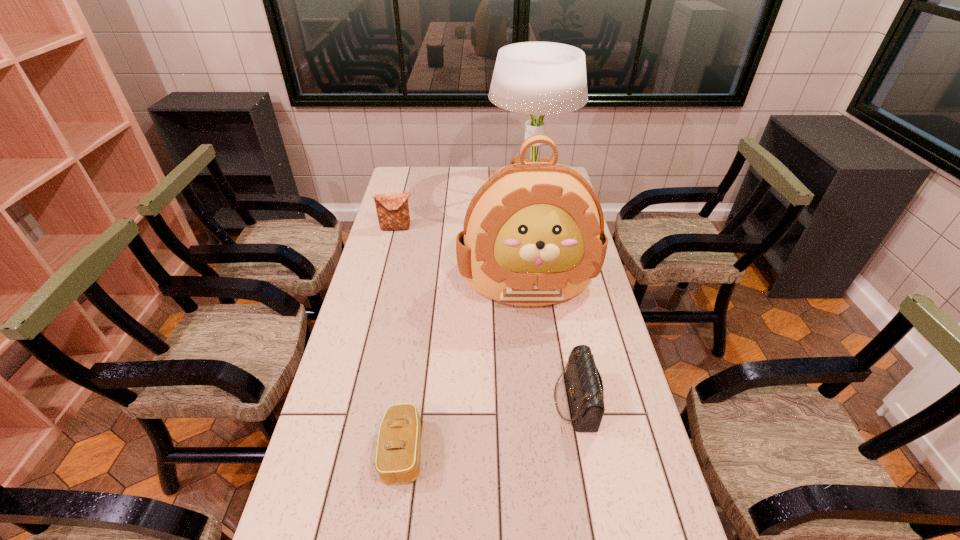
You are a GUI agent. You are given a task and a screenshot of the screen. Output one action in this format:
    pyautogui.click(x=<x>, y=<y>)
    Task: Click on the free location located 0.250m on the front-facing side of the farthest object
    Image resolution: width=960 pixels, height=540 pixels.
    Given the screenshot: What is the action you would take?
    pyautogui.click(x=431, y=193)

This screenshot has height=540, width=960. In order to click on free region located 0.210m on the front-facing side of the backpack in this screenshot , I will do `click(539, 378)`.

Identify the location of vacant region located on the open side of the leftmost clutch bag. (377, 305).

This screenshot has height=540, width=960. Find the location of `free location located 0.400m on the front flap of the second tallest clutch bag`. free location located 0.400m on the front flap of the second tallest clutch bag is located at coordinates (403, 401).

Where is `vacant region located 0.120m on the front flap of the second tallest clutch bag`? vacant region located 0.120m on the front flap of the second tallest clutch bag is located at coordinates (509, 401).

Where is `free space located on the front flap of the second tallest clutch bag`? free space located on the front flap of the second tallest clutch bag is located at coordinates (497, 401).

You are a GUI agent. You are given a task and a screenshot of the screen. Output one action in this format:
    pyautogui.click(x=<x>, y=<y>)
    Task: Click on the vacant area situated on the zipper side of the second clutch bag from left to right
    This screenshot has width=960, height=540.
    Given the screenshot: What is the action you would take?
    pyautogui.click(x=507, y=451)

The width and height of the screenshot is (960, 540). In order to click on object positioned at the far edge in this screenshot , I will do `click(536, 78)`.

Find the location of `object that is positioned at the left edge`. object that is positioned at the left edge is located at coordinates (392, 209).

Image resolution: width=960 pixels, height=540 pixels. I want to click on lamp that is at the right edge, so click(x=536, y=78).